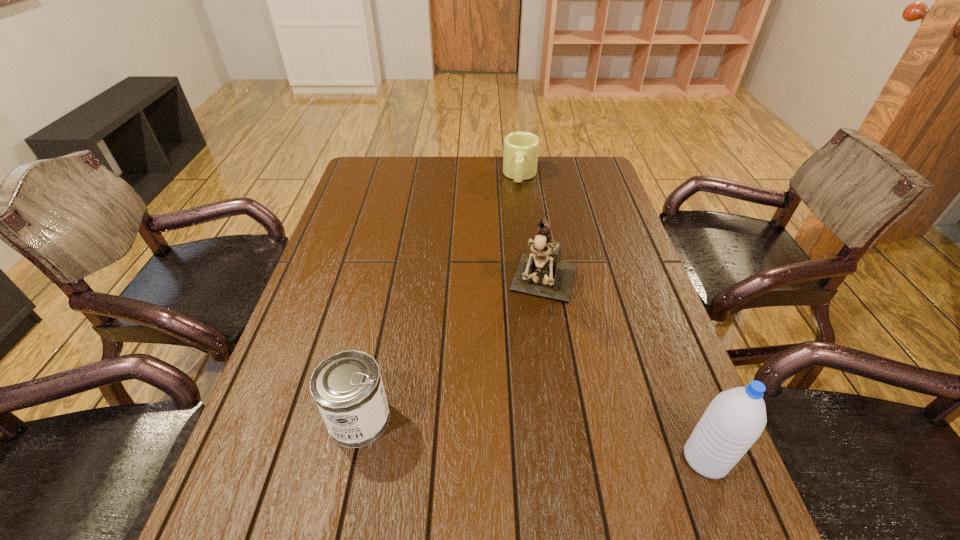
I want to click on object that is at the near right corner, so click(x=734, y=420).

In the image, there is a desktop. Identify the location of free space at the far edge. (453, 175).

In the image, there is a desktop. In order to click on vacant space at the near edge in this screenshot , I will do `click(635, 492)`.

Locate an element on the screen. free space at the left edge of the desktop is located at coordinates (320, 336).

Image resolution: width=960 pixels, height=540 pixels. In the image, there is a desktop. In order to click on free space at the right edge in this screenshot , I will do `click(607, 321)`.

The width and height of the screenshot is (960, 540). Identify the location of free region at the far left corner. (374, 178).

Find the location of `free spot at the near left corner of the desktop`. free spot at the near left corner of the desktop is located at coordinates (265, 451).

At what (x,y) coordinates should I click in order to perform the action: click on blank area at the far right corner. Please return your answer as a coordinate pair (x, y). Image resolution: width=960 pixels, height=540 pixels. Looking at the image, I should click on (573, 161).

At what (x,y) coordinates should I click in order to perform the action: click on unoccupied position between the can and the second farthest object. Please return your answer as a coordinate pair (x, y). The width and height of the screenshot is (960, 540). Looking at the image, I should click on (452, 353).

This screenshot has height=540, width=960. Identify the location of free area in between the rightmost object and the can. (533, 439).